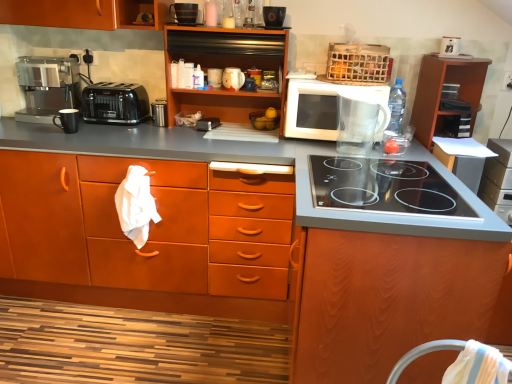
Question: Considering the relative sizes of wooden cabinet at center, which ranks as the 2th cabinetry in right-to-left order, and metallic silver toaster at center, the fourth appliance in the right-to-left sequence, in the image provided, is wooden cabinet at center, which ranks as the 2th cabinetry in right-to-left order, shorter than metallic silver toaster at center, the fourth appliance in the right-to-left sequence,?

Choices:
 (A) no
 (B) yes

Answer: (A)

Question: Is wooden cabinet at center, which ranks as the 2th cabinetry in right-to-left order, bigger than metallic silver toaster at center, the fourth appliance in the right-to-left sequence?

Choices:
 (A) yes
 (B) no

Answer: (A)

Question: From the image's perspective, would you say wooden cabinet at center, which ranks as the 2th cabinetry in right-to-left order, is positioned over metallic silver toaster at center, the third appliance when ordered from bottom to top?

Choices:
 (A) no
 (B) yes

Answer: (A)

Question: From the image's perspective, would you say wooden cabinet at center, which ranks as the 2th cabinetry in right-to-left order, is shown under metallic silver toaster at center, the third appliance when ordered from bottom to top?

Choices:
 (A) yes
 (B) no

Answer: (A)

Question: Is wooden cabinet at center, which is the fourth cabinetry in left-to-right order, far away from metallic silver toaster at center, the third appliance when ordered from bottom to top?

Choices:
 (A) no
 (B) yes

Answer: (B)

Question: Is wooden cabinet at center, which is the fourth cabinetry in left-to-right order, completely or partially outside of metallic silver toaster at center, which is the third appliance from top to bottom?

Choices:
 (A) no
 (B) yes

Answer: (B)

Question: Is matte black toaster at upper left, the fifth appliance from the bottom, inside wooden cabinet at center, the 1th cabinetry when ordered from left to right?

Choices:
 (A) yes
 (B) no

Answer: (B)

Question: Does wooden cabinet at center, the 5th cabinetry when ordered from right to left, touch matte black toaster at upper left, which appears as the 3th appliance when viewed from the right?

Choices:
 (A) no
 (B) yes

Answer: (A)

Question: Considering the relative positions of wooden cabinet at center, the 1th cabinetry when ordered from left to right, and matte black toaster at upper left, the fifth appliance from the bottom, in the image provided, is wooden cabinet at center, the 1th cabinetry when ordered from left to right, behind matte black toaster at upper left, the fifth appliance from the bottom,?

Choices:
 (A) no
 (B) yes

Answer: (A)

Question: Is wooden cabinet at center, the 5th cabinetry when ordered from right to left, thinner than matte black toaster at upper left, which appears as the 3th appliance when viewed from the right?

Choices:
 (A) yes
 (B) no

Answer: (B)

Question: Is wooden cabinet at center, the 5th cabinetry when ordered from right to left, oriented towards matte black toaster at upper left, which is counted as the 3th appliance, starting from the left?

Choices:
 (A) yes
 (B) no

Answer: (B)

Question: Is wooden cabinet at center, the 5th cabinetry when ordered from right to left, completely or partially outside of matte black toaster at upper left, the 1th appliance when ordered from top to bottom?

Choices:
 (A) no
 (B) yes

Answer: (B)

Question: Can you confirm if metallic silver toaster at center, the fourth appliance in the right-to-left sequence, is bigger than black plastic toaster at left?

Choices:
 (A) yes
 (B) no

Answer: (B)